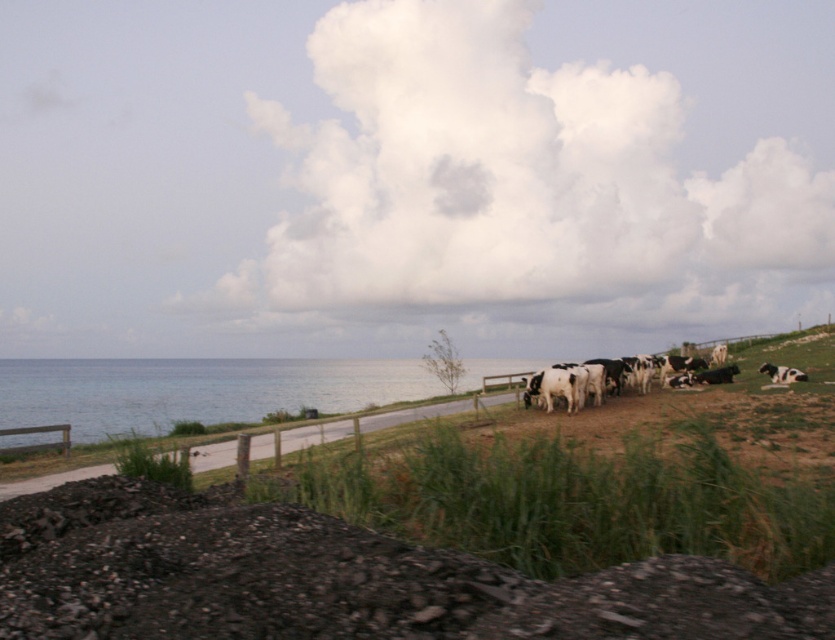
You are standing at the edge of the ocean looking towards the grassy hill. Which direction should you walk to reach the green grass at center?

The green grass at center is located at point (565, 499), which is towards the upper part of the image. Since you are at the ocean edge, you should walk inland towards the center of the image to reach the green grass at center.

You are a photographer planning to capture the entire scene of the green grass at center and the black and white spotted cow at right in one shot. Based on their sizes, which object would occupy more of the frame?

The green grass at center would occupy more of the frame since its width is larger than that of the black and white spotted cow at right.